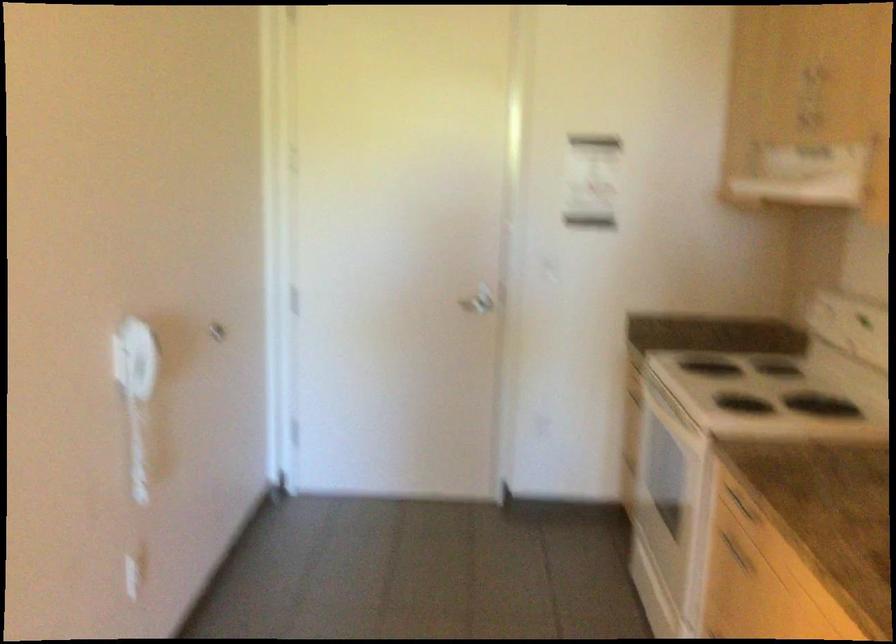
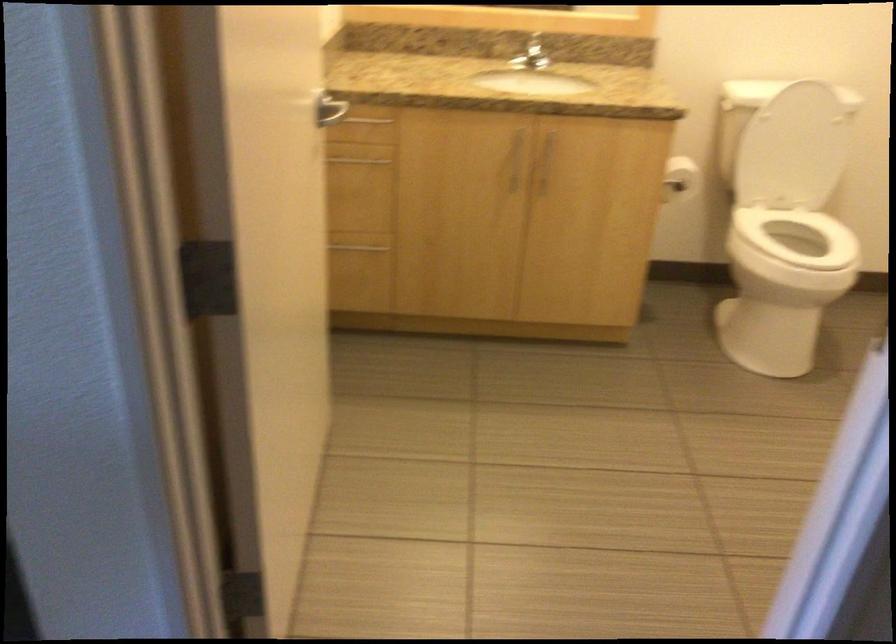
The images are taken continuously from a first-person perspective. In which direction is your viewpoint rotating?

The rotation direction of the camera is left-down.